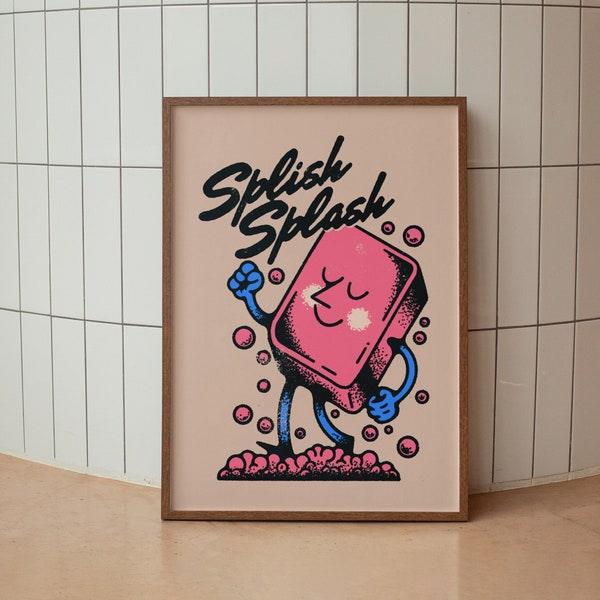
Where is `wall hanging`? wall hanging is located at coordinates (407, 153).